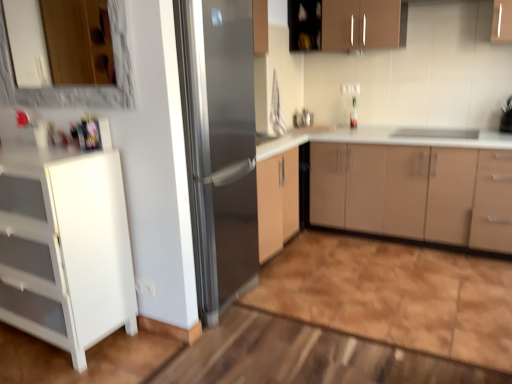
Question: From the image's perspective, is stainless steel refrigerator at center on top of white glossy cabinet at left, the 1th cabinetry from the left?

Choices:
 (A) yes
 (B) no

Answer: (A)

Question: Is stainless steel refrigerator at center positioned beyond the bounds of white glossy cabinet at left, the 1th cabinetry from the left?

Choices:
 (A) yes
 (B) no

Answer: (A)

Question: Does stainless steel refrigerator at center have a lesser width compared to white glossy cabinet at left, which appears as the third cabinetry when viewed from the top?

Choices:
 (A) yes
 (B) no

Answer: (B)

Question: Considering the relative sizes of stainless steel refrigerator at center and white glossy cabinet at left, which ranks as the third cabinetry in right-to-left order, in the image provided, is stainless steel refrigerator at center smaller than white glossy cabinet at left, which ranks as the third cabinetry in right-to-left order,?

Choices:
 (A) no
 (B) yes

Answer: (A)

Question: Could you tell me if stainless steel refrigerator at center is turned towards white glossy cabinet at left, which appears as the third cabinetry when viewed from the top?

Choices:
 (A) yes
 (B) no

Answer: (B)

Question: Based on their positions, is brown matte cabinet at upper center, the third cabinetry when ordered from bottom to top, located to the left or right of stainless steel refrigerator at center?

Choices:
 (A) right
 (B) left

Answer: (A)

Question: Do you think brown matte cabinet at upper center, which is the 2th cabinetry from right to left, is within stainless steel refrigerator at center, or outside of it?

Choices:
 (A) inside
 (B) outside

Answer: (B)

Question: Is point (396, 29) closer or farther from the camera than point (189, 72)?

Choices:
 (A) farther
 (B) closer

Answer: (A)

Question: From the image's perspective, is brown matte cabinet at upper center, which is counted as the second cabinetry, starting from the left, located above or below stainless steel refrigerator at center?

Choices:
 (A) above
 (B) below

Answer: (A)

Question: Considering the positions of matte beige cabinet at center, which appears as the second cabinetry when viewed from the top, and wooden frame mirror at upper left in the image, is matte beige cabinet at center, which appears as the second cabinetry when viewed from the top, wider or thinner than wooden frame mirror at upper left?

Choices:
 (A) thin
 (B) wide

Answer: (B)

Question: From a real-world perspective, is matte beige cabinet at center, the first cabinetry viewed from the right, positioned above or below wooden frame mirror at upper left?

Choices:
 (A) above
 (B) below

Answer: (B)

Question: Does point (483, 158) appear closer or farther from the camera than point (114, 44)?

Choices:
 (A) closer
 (B) farther

Answer: (B)

Question: From their relative heights in the image, would you say matte beige cabinet at center, the first cabinetry viewed from the right, is taller or shorter than wooden frame mirror at upper left?

Choices:
 (A) short
 (B) tall

Answer: (B)

Question: Is matte beige cabinet at center, which appears as the second cabinetry when viewed from the top, wider or thinner than white glossy cabinet at left, which appears as the third cabinetry when viewed from the top?

Choices:
 (A) wide
 (B) thin

Answer: (A)

Question: Looking at the image, does matte beige cabinet at center, which is the second cabinetry from bottom to top, seem bigger or smaller compared to white glossy cabinet at left, the 1th cabinetry from the left?

Choices:
 (A) big
 (B) small

Answer: (A)